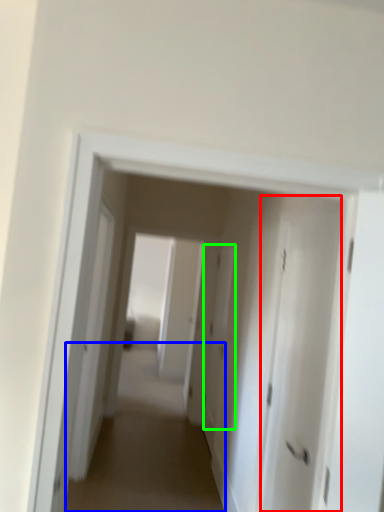
Question: Which object is the closest to the door (highlighted by a red box)? Choose among these: alley (highlighted by a blue box) or door (highlighted by a green box).

Choices:
 (A) alley
 (B) door

Answer: (A)